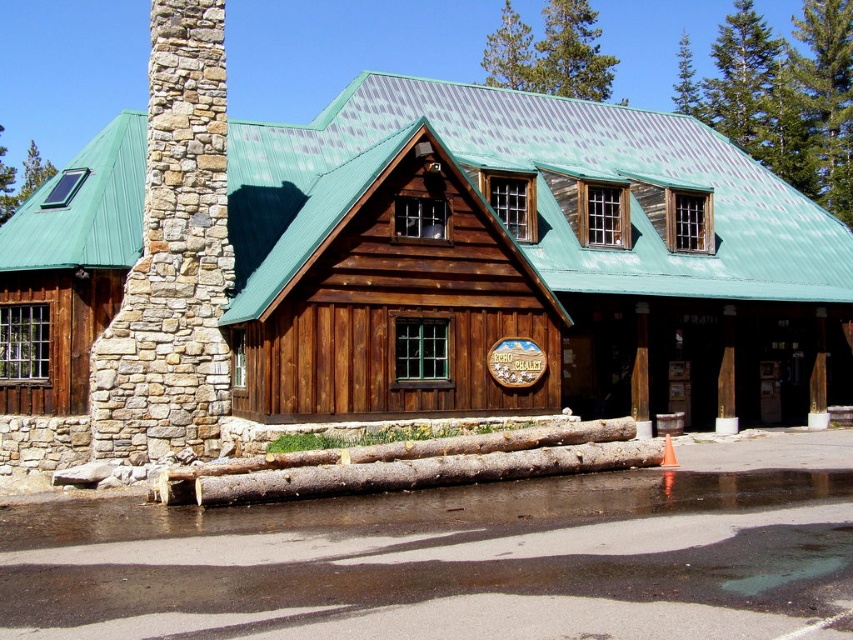
Question: Which of the following is the farthest from the observer?

Choices:
 (A) (186, 241)
 (B) (451, 458)

Answer: (A)

Question: Which object is closer to the camera taking this photo?

Choices:
 (A) wooden cabin at center
 (B) natural stone chimney at left

Answer: (A)

Question: Is natural stone chimney at left above smooth gray wood logs at center?

Choices:
 (A) no
 (B) yes

Answer: (B)

Question: Is natural stone chimney at left behind smooth gray wood logs at center?

Choices:
 (A) no
 (B) yes

Answer: (B)

Question: Observing the image, what is the correct spatial positioning of wooden cabin at center in reference to natural stone chimney at left?

Choices:
 (A) left
 (B) right

Answer: (B)

Question: Estimate the real-world distances between objects in this image. Which object is farther from the natural stone chimney at left?

Choices:
 (A) wooden cabin at center
 (B) smooth gray wood logs at center

Answer: (A)